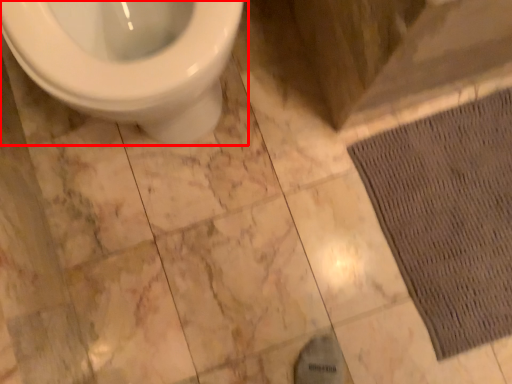
Question: Observing the image, what is the correct spatial positioning of toilet (annotated by the red box) in reference to doormat?

Choices:
 (A) left
 (B) right

Answer: (A)